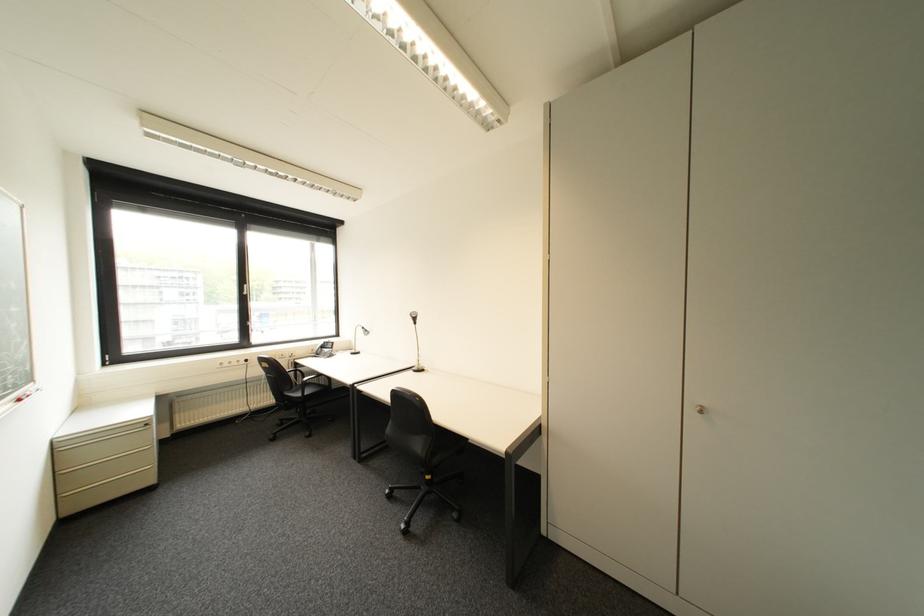
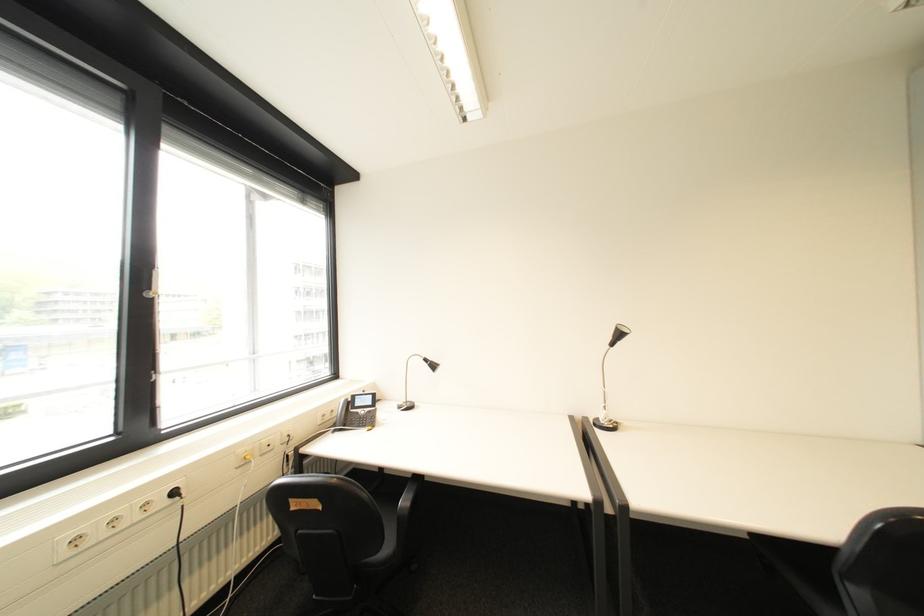
In a continuous first-person perspective shot, in which direction is the camera moving?

The cameraman walked toward left, forward.